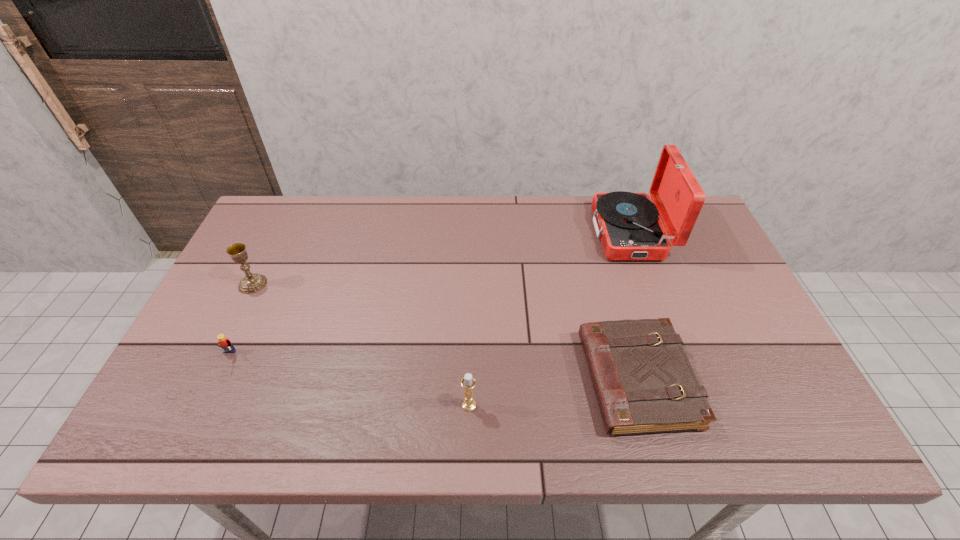
Find the location of a particular element. The image size is (960, 540). free space that satisfies the following two spatial constraints: 1. on the front-facing side of the hardback book; 2. on the right side of the fourth tallest object is located at coordinates (217, 379).